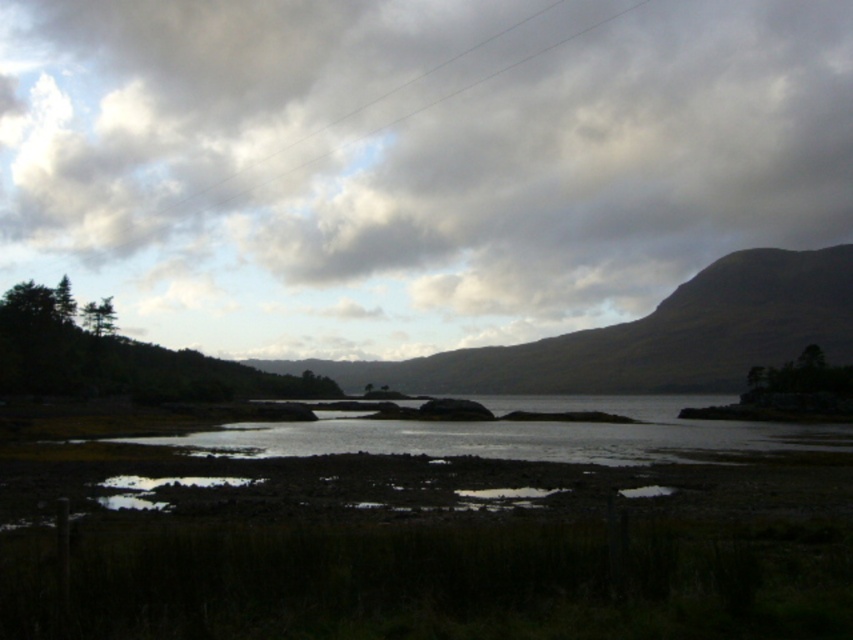
You are standing on the rocky shoreline and looking towards the upper center of the image. Which object is positioned higher in the scene between the cloudy sky at upper center and the green grassy hill at upper center?

The cloudy sky at upper center is located above the green grassy hill at upper center, so the cloudy sky at upper center is positioned higher in the scene.

You are standing at the edge of the loch and want to reach a specific point marked as point (149,19). Given that the distance between you and the point is 405.32 meters, can you estimate how long it would take to walk there at a normal walking pace of 5 km per hour?

The distance to point (149,19) is 405.32 meters. At a normal walking pace of 5 km per hour, it would take approximately 48.6 minutes to reach the point.

You are standing at the edge of the rocky shoreline and want to take a photo of the cloudy sky at upper center without the shiny metallic puddle at lower center blocking the view. Is this possible?

The shiny metallic puddle at lower center is behind the cloudy sky at upper center, so you can take a photo of the cloudy sky at upper center without the puddle blocking the view.